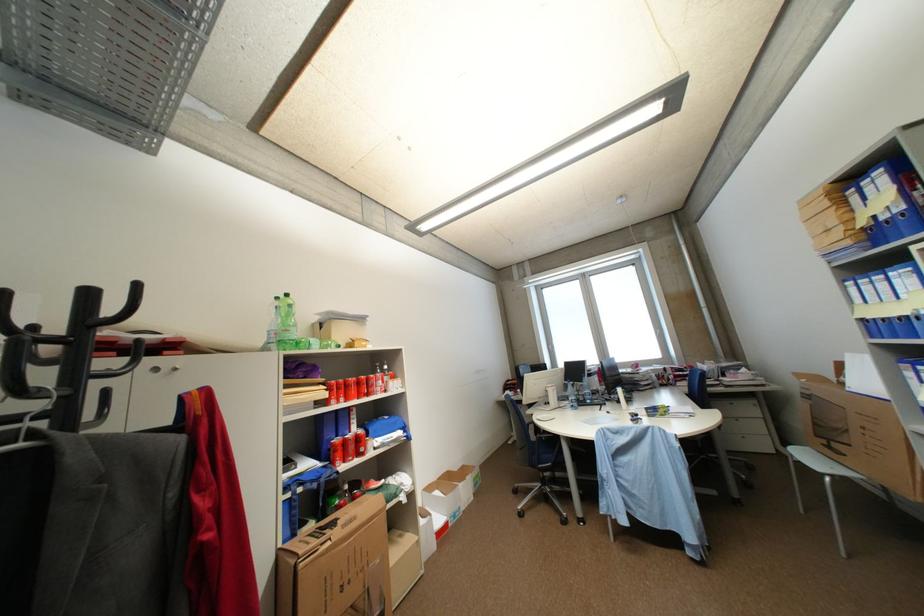
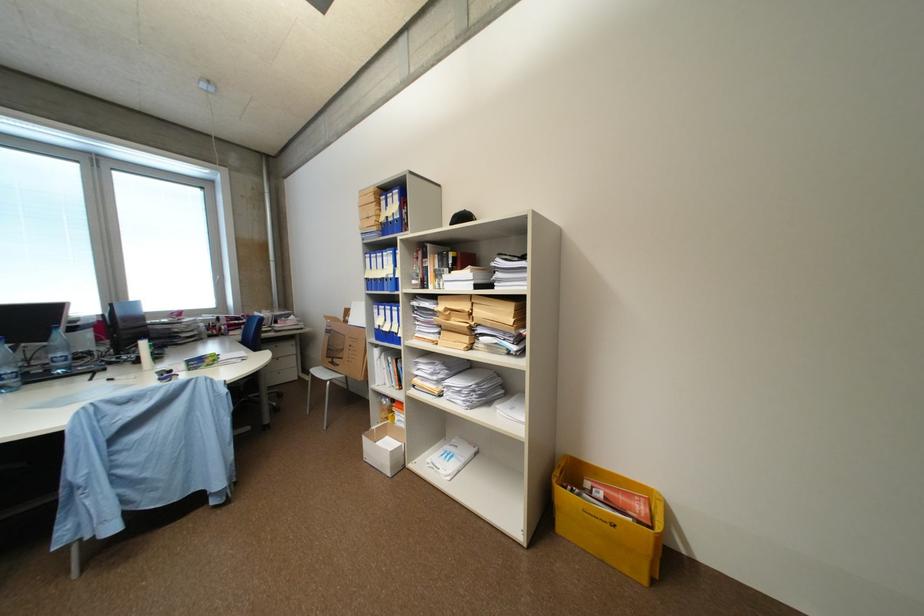
Where in the second image is the point corresponding to (x=823, y=424) from the first image?

(336, 350)